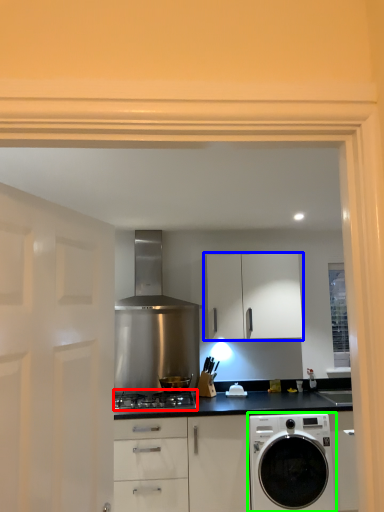
Question: Estimate the real-world distances between objects in this image. Which object is closer to gas stove (highlighted by a red box), cabinetry (highlighted by a blue box) or washing machine (highlighted by a green box)?

Choices:
 (A) cabinetry
 (B) washing machine

Answer: (B)